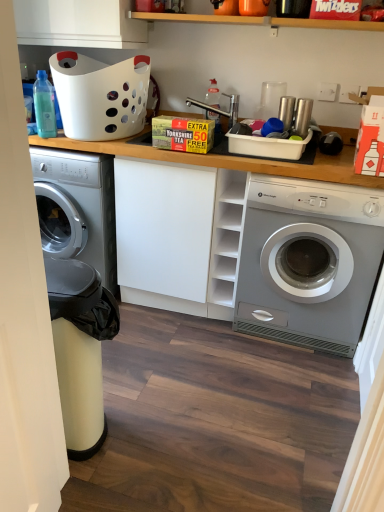
Question: Could you tell me if white matte cabinet at center is facing metallic faucet at center?

Choices:
 (A) no
 (B) yes

Answer: (A)

Question: Can you confirm if white matte cabinet at center is positioned to the right of metallic faucet at center?

Choices:
 (A) no
 (B) yes

Answer: (A)

Question: Can we say white matte cabinet at center lies outside metallic faucet at center?

Choices:
 (A) no
 (B) yes

Answer: (B)

Question: From a real-world perspective, is white matte cabinet at center on metallic faucet at center?

Choices:
 (A) no
 (B) yes

Answer: (A)

Question: Can you confirm if white matte cabinet at center is taller than metallic faucet at center?

Choices:
 (A) yes
 (B) no

Answer: (A)

Question: Is white matte cabinet at center in front of metallic faucet at center?

Choices:
 (A) yes
 (B) no

Answer: (A)

Question: Is metallic faucet at center shorter than white plastic basket at upper left?

Choices:
 (A) no
 (B) yes

Answer: (B)

Question: Does metallic faucet at center appear on the left side of white plastic basket at upper left?

Choices:
 (A) yes
 (B) no

Answer: (B)

Question: From a real-world perspective, does metallic faucet at center sit lower than white plastic basket at upper left?

Choices:
 (A) yes
 (B) no

Answer: (A)

Question: Is metallic faucet at center facing towards white plastic basket at upper left?

Choices:
 (A) yes
 (B) no

Answer: (B)

Question: Can you confirm if metallic faucet at center is thinner than white plastic basket at upper left?

Choices:
 (A) no
 (B) yes

Answer: (B)

Question: Is metallic faucet at center positioned with its back to white plastic basket at upper left?

Choices:
 (A) yes
 (B) no

Answer: (B)

Question: Is white plastic basket at upper left to the right of translucent plastic bottle at center, acting as the second bottle starting from the front, from the viewer's perspective?

Choices:
 (A) yes
 (B) no

Answer: (B)